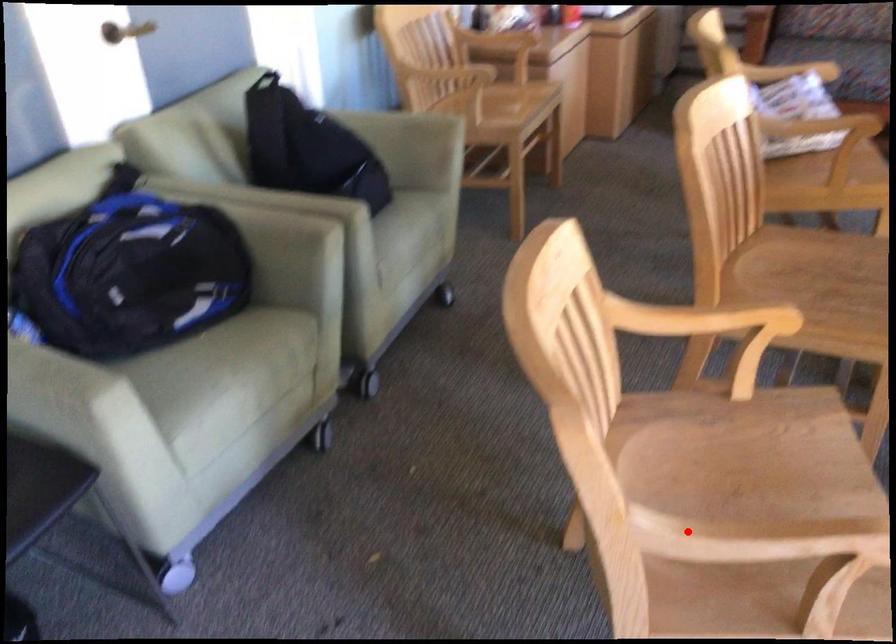
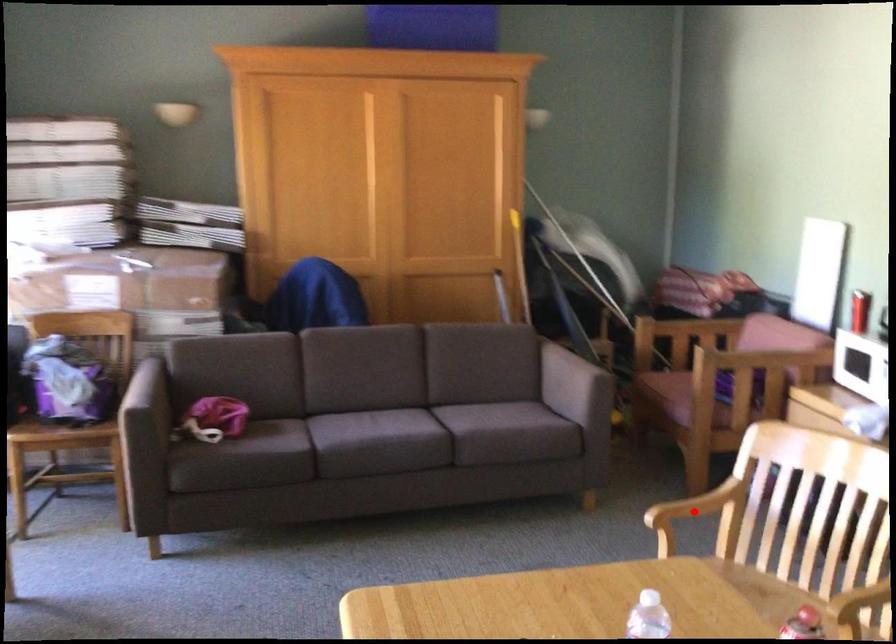
In the scene shown: I am providing you with two images of the same scene from different viewpoints. A red point is marked on the first image and another point is marked on the second image. Is the red point in image1 aligned with the point shown in image2?

Yes